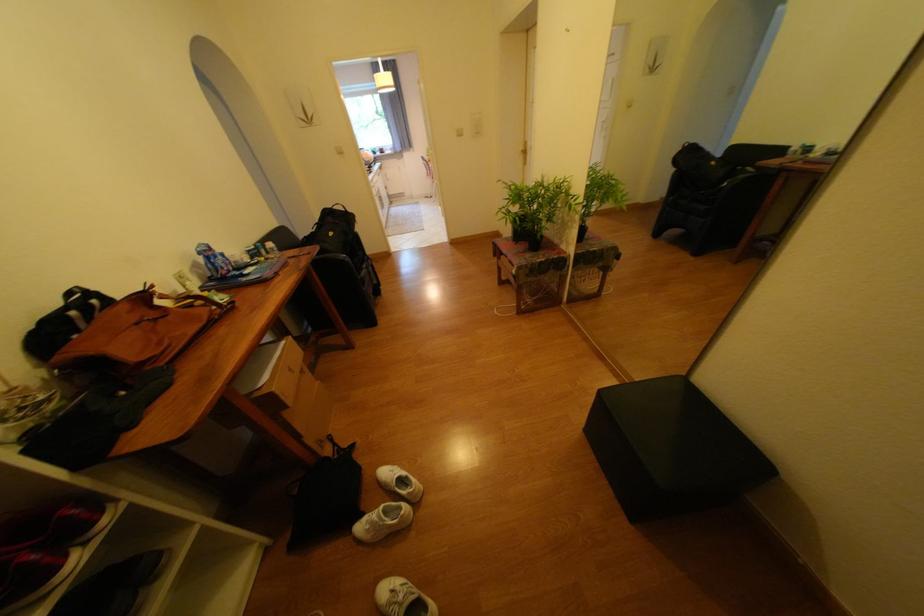
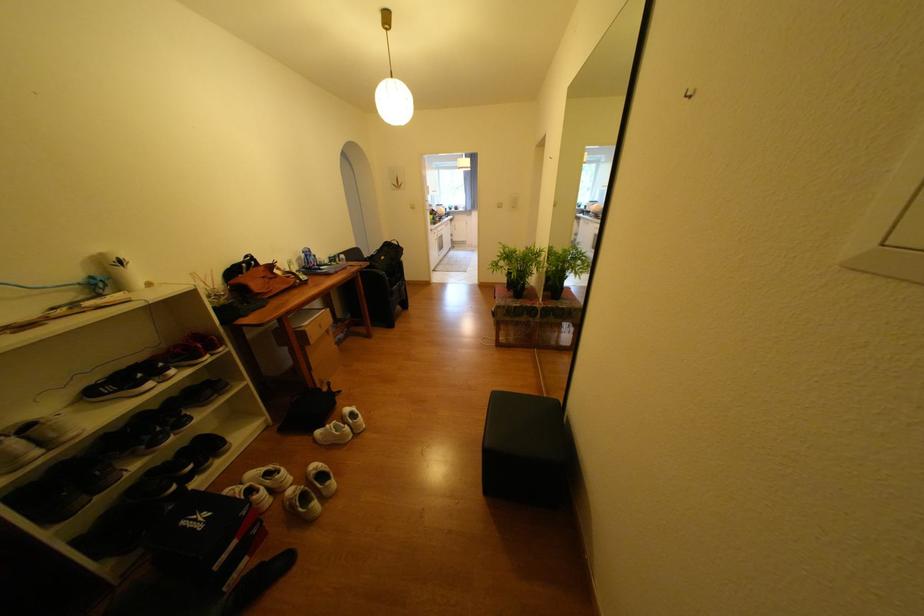
Where in the second image is the point corresponding to point 131,307 from the first image?

(271, 269)